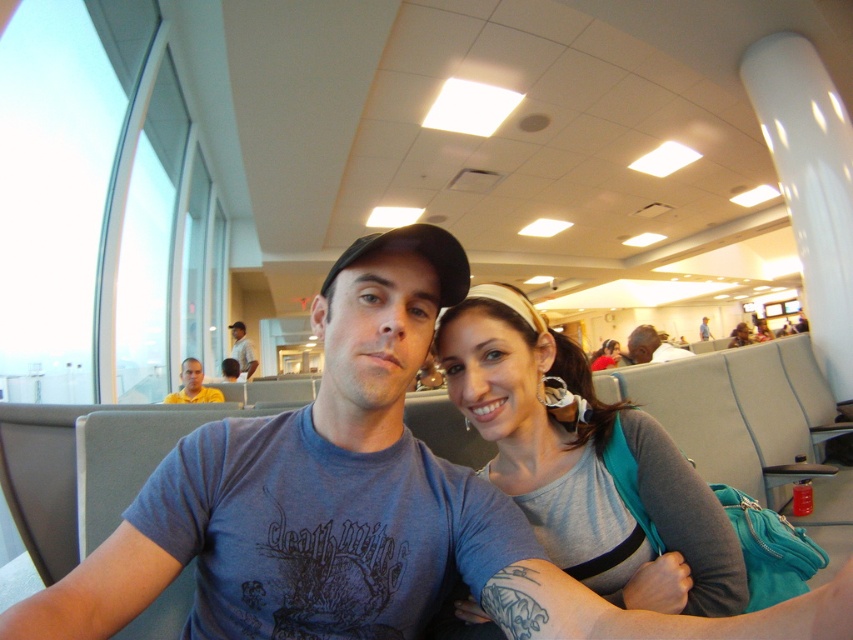
Question: Among these points, which one is farthest from the camera?

Choices:
 (A) (595, 355)
 (B) (634, 340)
 (C) (576, 355)
 (D) (199, 380)

Answer: (A)

Question: Which of the following is the farthest from the observer?

Choices:
 (A) (496, 413)
 (B) (241, 348)
 (C) (616, 346)
 (D) (177, 396)

Answer: (C)

Question: Does gray fabric shirt at center lie in front of yellow shirt at center?

Choices:
 (A) yes
 (B) no

Answer: (A)

Question: Can you confirm if gray fabric shirt at center is positioned above matte gray purse at center?

Choices:
 (A) yes
 (B) no

Answer: (A)

Question: Can you confirm if yellow t-shirt at center is bigger than matte gray purse at center?

Choices:
 (A) yes
 (B) no

Answer: (A)

Question: Which of these objects is positioned closest to the matte gray purse at center?

Choices:
 (A) smooth brown leather bag at center
 (B) yellow t-shirt at center
 (C) yellow shirt at center
 (D) gray fabric shirt at center

Answer: (A)